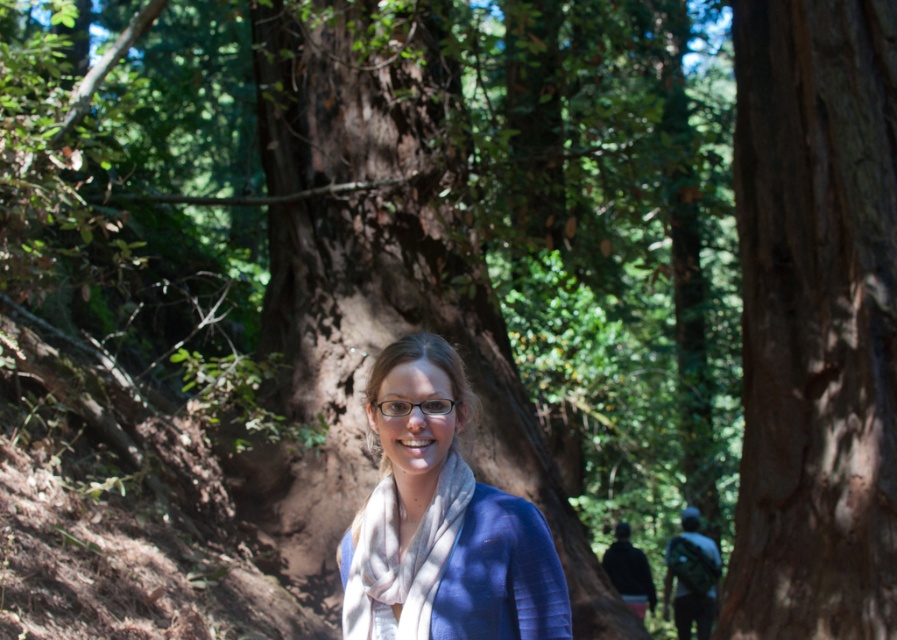
Question: Does blue matte scarf at center have a greater width compared to white soft scarf at center?

Choices:
 (A) no
 (B) yes

Answer: (B)

Question: Which point appears closest to the camera in this image?

Choices:
 (A) (456, 502)
 (B) (443, 616)
 (C) (832, 464)

Answer: (B)

Question: Does blue matte scarf at center come behind white soft scarf at center?

Choices:
 (A) no
 (B) yes

Answer: (A)

Question: Where is brown rough bark tree at center located in relation to blue matte scarf at center in the image?

Choices:
 (A) left
 (B) right

Answer: (B)

Question: Which object is closer to the camera taking this photo?

Choices:
 (A) brown rough bark tree at center
 (B) blue matte scarf at center

Answer: (B)

Question: Considering the real-world distances, which object is closest to the white soft scarf at center?

Choices:
 (A) brown rough bark tree at center
 (B) blue matte scarf at center

Answer: (B)